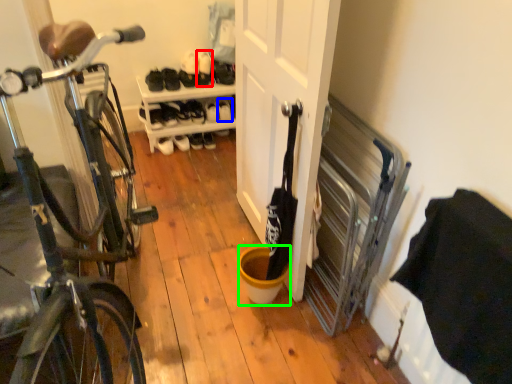
Question: Which object is the closest to the shoe (highlighted by a red box)? Choose among these: shoe (highlighted by a blue box) or bucket (highlighted by a green box).

Choices:
 (A) shoe
 (B) bucket

Answer: (A)